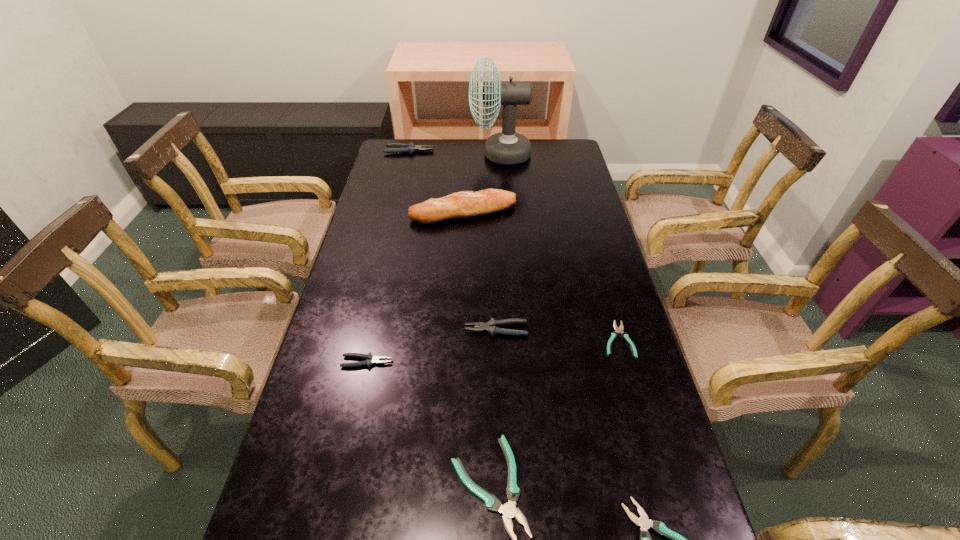
The width and height of the screenshot is (960, 540). I want to click on free space located in front of the fan where the airflow is directed, so click(389, 154).

In order to click on vacant space located in front of the fan where the airflow is directed in this screenshot , I will do `click(434, 154)`.

Where is `free location located in front of the fan where the airflow is directed`? free location located in front of the fan where the airflow is directed is located at coordinates (434, 154).

Find the location of `free space located on the right of the third farthest object`. free space located on the right of the third farthest object is located at coordinates (553, 212).

At what (x,y) coordinates should I click in order to perform the action: click on free point located 0.060m at the gripping part of the farthest pliers. Please return your answer as a coordinate pair (x, y). The width and height of the screenshot is (960, 540). Looking at the image, I should click on (447, 151).

At what (x,y) coordinates should I click in order to perform the action: click on vacant area situated 0.170m at the gripping part of the rightmost gray pliers. Please return your answer as a coordinate pair (x, y). The height and width of the screenshot is (540, 960). Looking at the image, I should click on (401, 329).

Where is `vacant space located at the gripping part of the rightmost gray pliers`? Image resolution: width=960 pixels, height=540 pixels. vacant space located at the gripping part of the rightmost gray pliers is located at coordinates coord(405,329).

Identify the location of vacant space located 0.320m at the gripping part of the rightmost gray pliers. (346, 329).

At what (x,y) coordinates should I click in order to perform the action: click on free space located at the gripping part of the nearest gray pliers. Please return your answer as a coordinate pair (x, y). Looking at the image, I should click on (436, 362).

I want to click on free spot located 0.070m on the left of the farthest teal pliers, so click(576, 339).